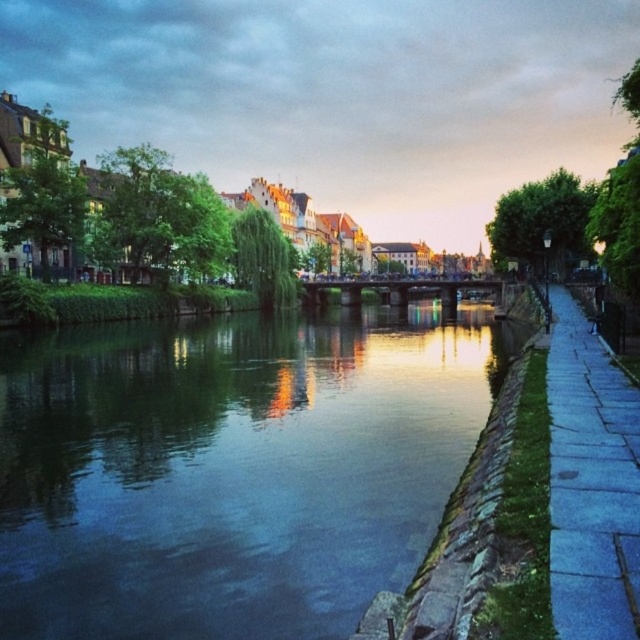
Does green stone river at center have a lesser width compared to blue stone sidewalk at right?

Incorrect, green stone river at center's width is not less than blue stone sidewalk at right's.

From the picture: Is green stone river at center taller than blue stone sidewalk at right?

Yes, green stone river at center is taller than blue stone sidewalk at right.

Does point (380, 586) come behind point (596, 380)?

No, (380, 586) is closer to viewer.

Where is `green stone river at center`? green stone river at center is located at coordinates (230, 468).